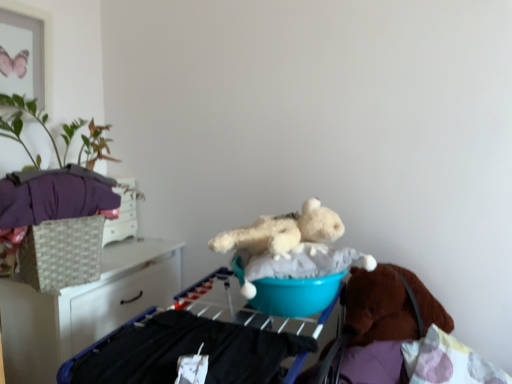
Question: Does white wicker basket at left have a larger size compared to fluffy white teddy bear at center?

Choices:
 (A) yes
 (B) no

Answer: (A)

Question: From the image's perspective, does white wicker basket at left appear higher than fluffy white teddy bear at center?

Choices:
 (A) yes
 (B) no

Answer: (B)

Question: From the image's perspective, is white wicker basket at left located beneath fluffy white teddy bear at center?

Choices:
 (A) no
 (B) yes

Answer: (B)

Question: From a real-world perspective, is white wicker basket at left below fluffy white teddy bear at center?

Choices:
 (A) yes
 (B) no

Answer: (A)

Question: Is white wicker basket at left taller than fluffy white teddy bear at center?

Choices:
 (A) no
 (B) yes

Answer: (B)

Question: Is teal plastic bucket at center bigger or smaller than green leafy plant at upper left?

Choices:
 (A) big
 (B) small

Answer: (A)

Question: Is point (425, 359) positioned closer to the camera than point (26, 145)?

Choices:
 (A) farther
 (B) closer

Answer: (B)

Question: Considering the positions of teal plastic bucket at center and green leafy plant at upper left in the image, is teal plastic bucket at center wider or thinner than green leafy plant at upper left?

Choices:
 (A) thin
 (B) wide

Answer: (B)

Question: Is teal plastic bucket at center situated inside green leafy plant at upper left or outside?

Choices:
 (A) outside
 (B) inside

Answer: (A)

Question: Considering the relative positions of green leafy plant at upper left and purple fleece glove at left in the image provided, is green leafy plant at upper left to the left or to the right of purple fleece glove at left?

Choices:
 (A) right
 (B) left

Answer: (B)

Question: Is green leafy plant at upper left inside or outside of purple fleece glove at left?

Choices:
 (A) outside
 (B) inside

Answer: (A)

Question: In the image, is green leafy plant at upper left positioned in front of or behind purple fleece glove at left?

Choices:
 (A) front
 (B) behind

Answer: (A)

Question: From the image's perspective, is green leafy plant at upper left positioned above or below purple fleece glove at left?

Choices:
 (A) above
 (B) below

Answer: (A)

Question: From a real-world perspective, relative to green leafy plant at upper left, is blue plastic basin at center vertically above or below?

Choices:
 (A) below
 (B) above

Answer: (A)

Question: Considering their positions, is blue plastic basin at center located in front of or behind green leafy plant at upper left?

Choices:
 (A) front
 (B) behind

Answer: (A)